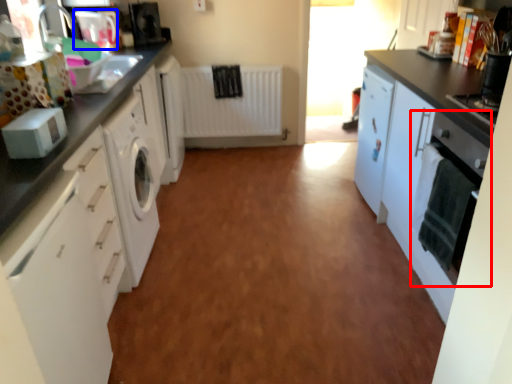
Question: Among these objects, which one is farthest to the camera, home appliance (highlighted by a red box) or appliance (highlighted by a blue box)?

Choices:
 (A) home appliance
 (B) appliance

Answer: (B)